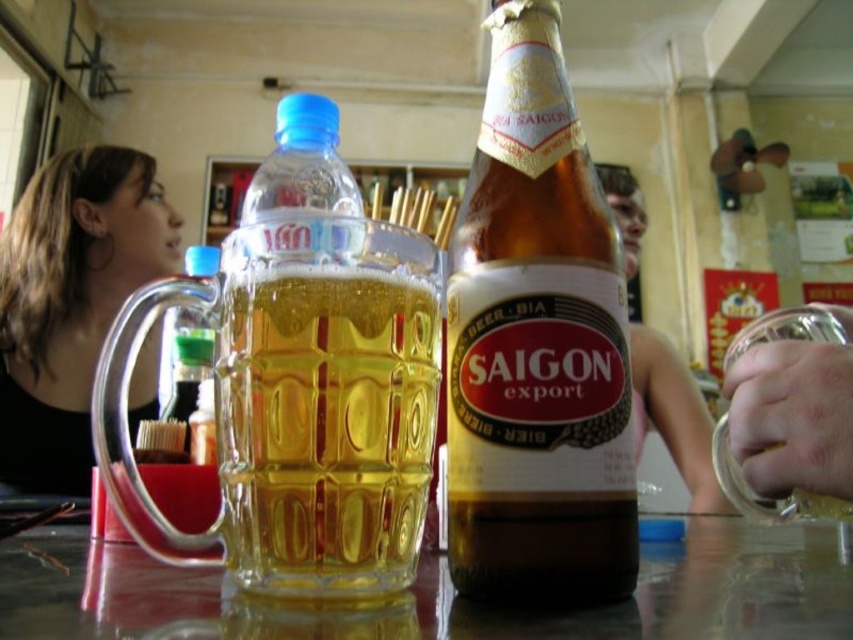
Question: Is brown glass bottle at center closer to camera compared to green glass bottle at center?

Choices:
 (A) no
 (B) yes

Answer: (B)

Question: Which point is farther to the camera?

Choices:
 (A) (22, 316)
 (B) (489, 467)

Answer: (A)

Question: Observing the image, what is the correct spatial positioning of brown glass bottle at center in reference to green glass bottle at center?

Choices:
 (A) left
 (B) right

Answer: (B)

Question: Which object is closer to the camera taking this photo?

Choices:
 (A) green glass bottle at center
 (B) transparent glass table at center
 (C) transparent glass beer glass at center
 (D) black fabric hair at left

Answer: (B)

Question: Estimate the real-world distances between objects in this image. Which object is closer to the transparent glass table at center?

Choices:
 (A) brown glass bottle at center
 (B) black fabric hair at left
 (C) transparent glass beer glass at center

Answer: (A)

Question: Is transparent glass table at center positioned behind transparent glass beer glass at center?

Choices:
 (A) yes
 (B) no

Answer: (B)